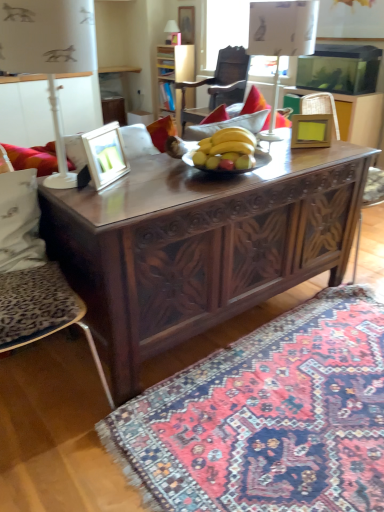
Question: Can you confirm if white fabric pillow at left is bigger than wooden picture frame at upper center, which ranks as the first picture frame in back-to-front order?

Choices:
 (A) yes
 (B) no

Answer: (A)

Question: Does white fabric pillow at left appear on the left side of wooden picture frame at upper center, the third picture frame when ordered from bottom to top?

Choices:
 (A) no
 (B) yes

Answer: (B)

Question: Is white fabric pillow at left oriented towards wooden picture frame at upper center, the third picture frame when ordered from bottom to top?

Choices:
 (A) no
 (B) yes

Answer: (A)

Question: Are white fabric pillow at left and wooden picture frame at upper center, which ranks as the first picture frame in back-to-front order, far apart?

Choices:
 (A) yes
 (B) no

Answer: (A)

Question: Is white fabric pillow at left closer to the viewer compared to wooden picture frame at upper center, the third picture frame when ordered from bottom to top?

Choices:
 (A) yes
 (B) no

Answer: (A)

Question: Based on their positions, is leopard print cushion at left, the second chair from the right, located to the left or right of carpet with intricate patterns at lower right?

Choices:
 (A) left
 (B) right

Answer: (A)

Question: Considering the positions of leopard print cushion at left, which is the second chair from top to bottom, and carpet with intricate patterns at lower right in the image, is leopard print cushion at left, which is the second chair from top to bottom, bigger or smaller than carpet with intricate patterns at lower right?

Choices:
 (A) big
 (B) small

Answer: (A)

Question: Which is correct: leopard print cushion at left, the 1th chair ordered from the bottom, is inside carpet with intricate patterns at lower right, or outside of it?

Choices:
 (A) inside
 (B) outside

Answer: (B)

Question: From the image's perspective, is leopard print cushion at left, which is the 2th chair from back to front, positioned above or below carpet with intricate patterns at lower right?

Choices:
 (A) above
 (B) below

Answer: (A)

Question: Looking at their shapes, would you say white plastic lamp at left, the first lamp in the bottom-to-top sequence, is wider or thinner than leopard print cushion at left, which is the 2th chair from back to front?

Choices:
 (A) wide
 (B) thin

Answer: (B)

Question: Which is correct: white plastic lamp at left, placed as the 3th lamp when sorted from back to front, is inside leopard print cushion at left, which is the 2th chair from back to front, or outside of it?

Choices:
 (A) inside
 (B) outside

Answer: (B)

Question: From the image's perspective, is white plastic lamp at left, which is the 1th lamp from left to right, located above or below leopard print cushion at left, which is the 2th chair from back to front?

Choices:
 (A) above
 (B) below

Answer: (A)

Question: Would you say white plastic lamp at left, which is the 1th lamp from left to right, is to the left or to the right of leopard print cushion at left, marked as the first chair in a left-to-right arrangement, in the picture?

Choices:
 (A) right
 (B) left

Answer: (A)

Question: Do you think matte wooden picture frame at left, the 1th picture frame positioned from the bottom, is within white plastic lamp at left, which appears as the 1th lamp when viewed from the front, or outside of it?

Choices:
 (A) inside
 (B) outside

Answer: (A)

Question: In the image, is matte wooden picture frame at left, the 1th picture frame positioned from the bottom, on the left side or the right side of white plastic lamp at left, the 3th lamp viewed from the right?

Choices:
 (A) left
 (B) right

Answer: (B)